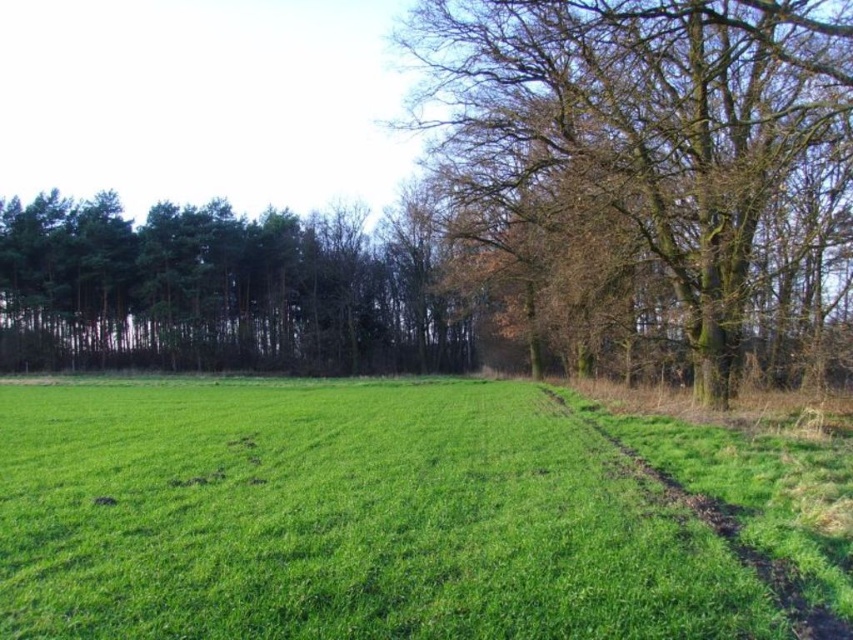
Can you confirm if brown rough bark tree at upper right is positioned below green grassy path at right?

Actually, brown rough bark tree at upper right is above green grassy path at right.

Can you confirm if brown rough bark tree at upper right is shorter than green grassy path at right?

In fact, brown rough bark tree at upper right may be taller than green grassy path at right.

The image size is (853, 640). Describe the element at coordinates (634, 131) in the screenshot. I see `brown rough bark tree at upper right` at that location.

Where is `brown rough bark tree at upper right`? The width and height of the screenshot is (853, 640). brown rough bark tree at upper right is located at coordinates (634, 131).

Is green leafy trees at left above green grassy path at right?

Yes, green leafy trees at left is above green grassy path at right.

Between point (277, 211) and point (712, 518), which one is positioned in front?

Positioned in front is point (712, 518).

Identify the location of green leafy trees at left. (210, 292).

From the picture: Is green grass at center above green grassy path at right?

No.

Is green grass at center to the left of green grassy path at right from the viewer's perspective?

Correct, you'll find green grass at center to the left of green grassy path at right.

At what (x,y) coordinates should I click in order to perform the action: click on green grass at center. Please return your answer as a coordinate pair (x, y). The height and width of the screenshot is (640, 853). Looking at the image, I should click on (x=401, y=515).